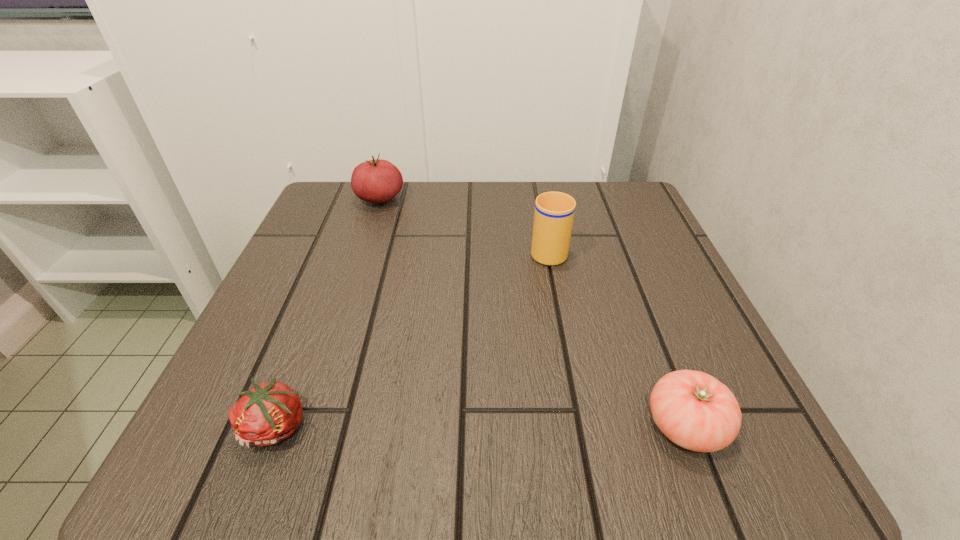
This screenshot has width=960, height=540. I want to click on free space at the far left corner, so click(306, 239).

The height and width of the screenshot is (540, 960). I want to click on vacant area at the near left corner, so click(x=239, y=476).

This screenshot has height=540, width=960. In order to click on free space at the far right corner in this screenshot , I will do `click(576, 189)`.

You are a GUI agent. You are given a task and a screenshot of the screen. Output one action in this format:
    pyautogui.click(x=<x>, y=<y>)
    Task: Click on the free space at the near right corner
    The width and height of the screenshot is (960, 540).
    Given the screenshot: What is the action you would take?
    pyautogui.click(x=765, y=441)

Identify the location of unoccupied area between the farthest tomato and the rightmost tomato. (533, 313).

Locate an element on the screen. The width and height of the screenshot is (960, 540). empty space that is in between the rightmost tomato and the third object from left to right is located at coordinates (616, 338).

Locate an element on the screen. free spot between the cup and the rightmost tomato is located at coordinates (616, 338).

Image resolution: width=960 pixels, height=540 pixels. Find the location of `empty location between the cup and the farthest tomato`. empty location between the cup and the farthest tomato is located at coordinates (464, 225).

The image size is (960, 540). I want to click on free space between the rightmost object and the second farthest object, so click(x=616, y=338).

Locate which object is the closest to the rightmost tomato. Please provide its 2D coordinates. Your answer should be formatted as a tuple, i.e. [(x, y)], where the tuple contains the x and y coordinates of a point satisfying the conditions above.

[(554, 212)]